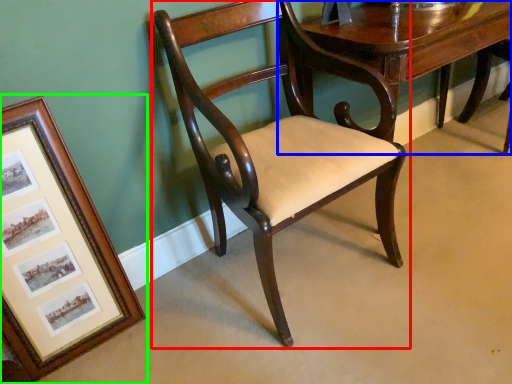
Question: Considering the real-world distances, which object is closest to chair (highlighted by a red box)? table (highlighted by a blue box) or picture frame (highlighted by a green box).

Choices:
 (A) table
 (B) picture frame

Answer: (A)